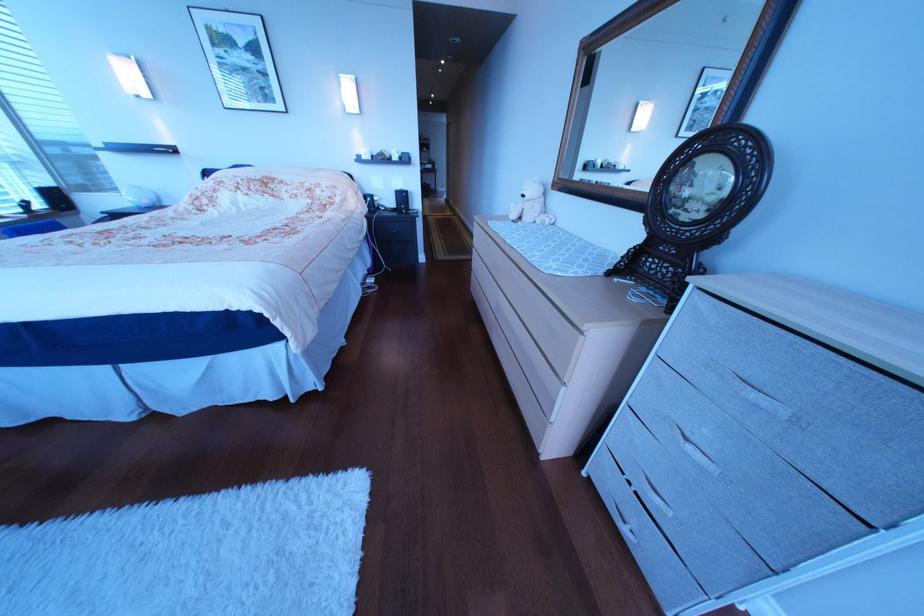
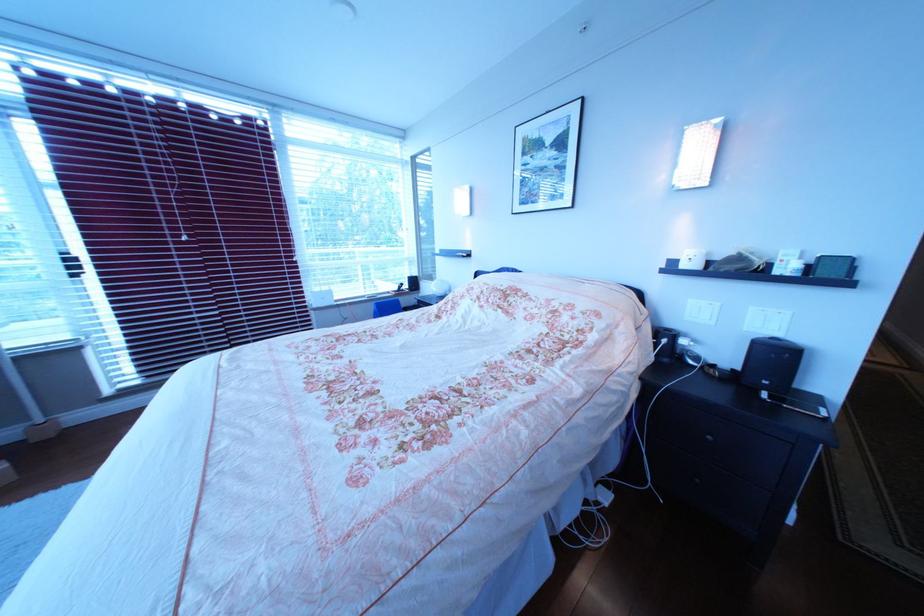
Where in the second image is the point corresponding to point (380, 160) from the first image?

(699, 267)